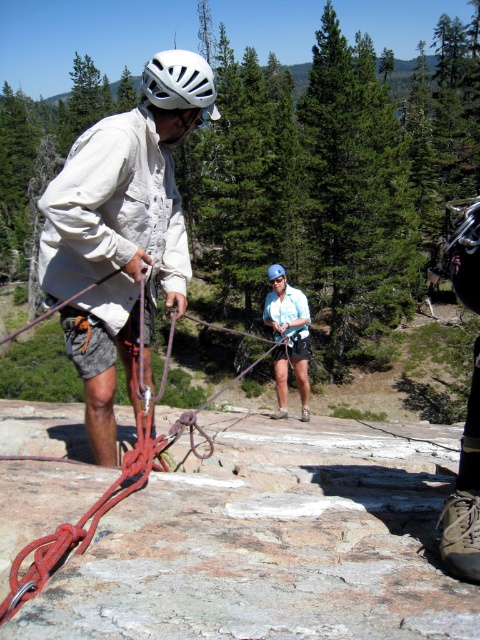
You are a safety inspector assessing the climbing setup. You notice the white matte helmet at center and the red synthetic rope at center. Which object appears larger in the scene?

The white matte helmet at center is bigger than the red synthetic rope at center.

Based on the photo, you are a safety inspector assessing the climbing setup. You notice the blue fabric shirt at center and the white matte helmet at upper center. Which object is narrower in width?

The blue fabric shirt at center has a lesser width compared to the white matte helmet at upper center, so the blue fabric shirt at center is narrower.